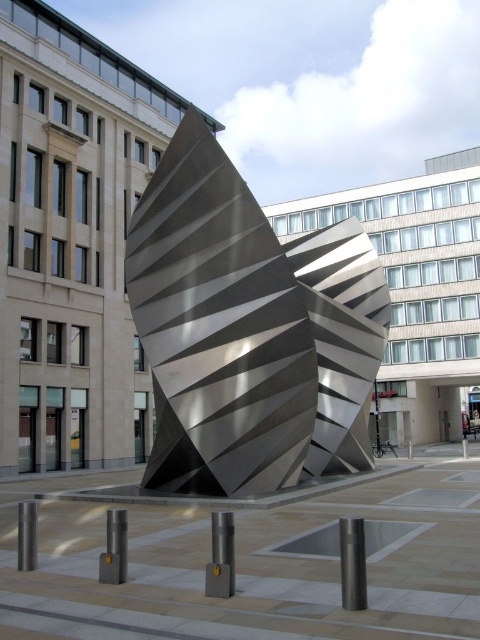
Question: Is satin silver sculpture at center to the right of polished silver post at center from the viewer's perspective?

Choices:
 (A) yes
 (B) no

Answer: (A)

Question: Among these points, which one is farthest from the camera?

Choices:
 (A) (24, 548)
 (B) (223, 548)

Answer: (A)

Question: Can you confirm if polished silver post at center is smaller than polished metal pole at lower left?

Choices:
 (A) yes
 (B) no

Answer: (A)

Question: Which is farther from the polished silver post at center?

Choices:
 (A) polished metal pole at lower left
 (B) polished silver pole at center
 (C) satin silver sculpture at center

Answer: (C)

Question: Does polished silver post at center have a larger size compared to polished metal pole at lower left?

Choices:
 (A) yes
 (B) no

Answer: (B)

Question: Which point appears farthest from the camera in this image?

Choices:
 (A) (173, 401)
 (B) (27, 564)
 (C) (107, 509)
 (D) (348, 534)

Answer: (A)